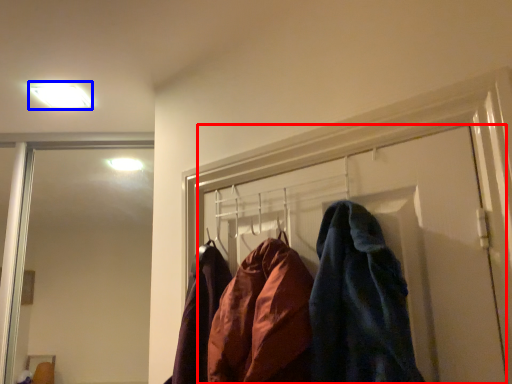
Question: Which object is closer to the camera taking this photo, door (highlighted by a red box) or light fixture (highlighted by a blue box)?

Choices:
 (A) door
 (B) light fixture

Answer: (A)